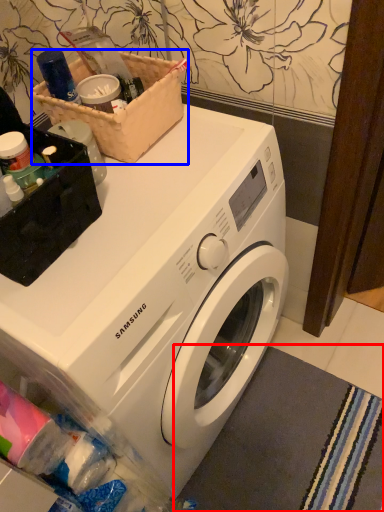
Question: Which object is further to the camera taking this photo, bath mat (highlighted by a red box) or basket (highlighted by a blue box)?

Choices:
 (A) bath mat
 (B) basket

Answer: (A)